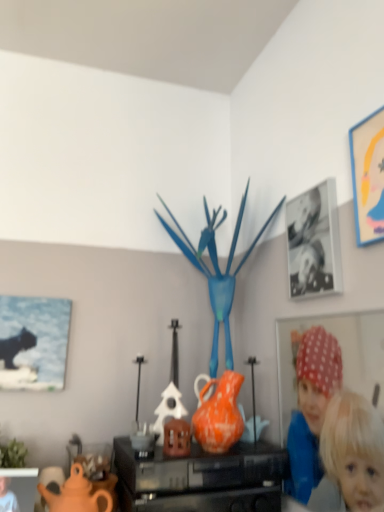
Question: From a real-world perspective, is matte black picture frame at lower left, the second picture frame viewed from the left, below orange matte vase at center?

Choices:
 (A) yes
 (B) no

Answer: (A)

Question: From a real-world perspective, is matte black picture frame at lower left, the second picture frame viewed from the left, physically above orange matte vase at center?

Choices:
 (A) no
 (B) yes

Answer: (A)

Question: Is the surface of matte black picture frame at lower left, the second picture frame viewed from the left, in direct contact with orange matte vase at center?

Choices:
 (A) no
 (B) yes

Answer: (A)

Question: Does matte black picture frame at lower left, which is the 4th picture frame in top-to-bottom order, have a greater width compared to orange matte vase at center?

Choices:
 (A) no
 (B) yes

Answer: (A)

Question: From the image's perspective, would you say matte black picture frame at lower left, which is the 1th picture frame from bottom to top, is positioned over orange matte vase at center?

Choices:
 (A) yes
 (B) no

Answer: (B)

Question: Visually, is matte yellow picture frame at upper right, which ranks as the 1th picture frame in right-to-left order, positioned to the left or to the right of matte black picture frame at lower left, which is the 4th picture frame in top-to-bottom order?

Choices:
 (A) right
 (B) left

Answer: (A)

Question: Is matte yellow picture frame at upper right, marked as the 4th picture frame in a left-to-right arrangement, inside or outside of matte black picture frame at lower left, the second picture frame viewed from the left?

Choices:
 (A) outside
 (B) inside

Answer: (A)

Question: From the image's perspective, is matte yellow picture frame at upper right, the first picture frame when ordered from top to bottom, above or below matte black picture frame at lower left, which appears as the third picture frame when viewed from the right?

Choices:
 (A) above
 (B) below

Answer: (A)

Question: In terms of height, does matte yellow picture frame at upper right, which ranks as the 1th picture frame in right-to-left order, look taller or shorter compared to matte black picture frame at lower left, which appears as the third picture frame when viewed from the right?

Choices:
 (A) tall
 (B) short

Answer: (A)

Question: From the image's perspective, relative to matte orange teapot at lower left, is orange matte vase at center above or below?

Choices:
 (A) below
 (B) above

Answer: (B)

Question: Considering their positions, is orange matte vase at center located in front of or behind matte orange teapot at lower left?

Choices:
 (A) front
 (B) behind

Answer: (B)

Question: Is orange matte vase at center bigger or smaller than matte orange teapot at lower left?

Choices:
 (A) big
 (B) small

Answer: (A)

Question: Is orange matte vase at center to the left or to the right of matte orange teapot at lower left in the image?

Choices:
 (A) right
 (B) left

Answer: (A)

Question: Is black glossy photo frame at upper right, positioned as the 2th picture frame in right-to-left order, taller or shorter than matte orange vase at center?

Choices:
 (A) short
 (B) tall

Answer: (B)

Question: Considering the positions of point (334, 196) and point (233, 453), is point (334, 196) closer or farther from the camera than point (233, 453)?

Choices:
 (A) closer
 (B) farther

Answer: (A)